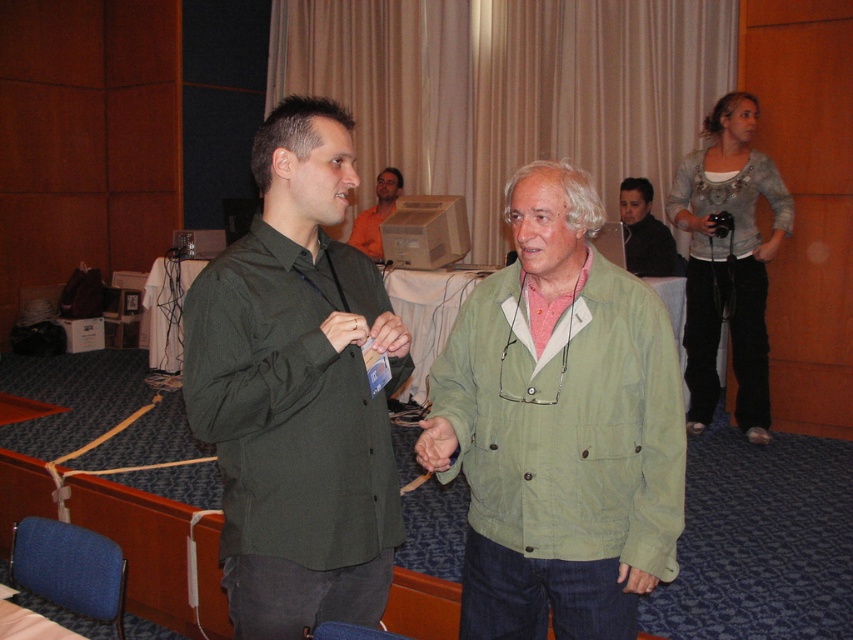
You are organizing a clothing display and need to arrange the green matte shirt at center and the orange shirt at upper center side by side. Which shirt should you place on the left to ensure they fit within a 1.2 meter wide display area?

The green matte shirt at center has a smaller width than the orange shirt at upper center. To fit them within the 1.2 meter display area, place the narrower green matte shirt at center on the left and the wider orange shirt at upper center on the right, ensuring their combined width does not exceed the available space.

What object is located at the coordinates point (297, 390)?

The point (297, 390) corresponds to the green matte shirt at center.

You are standing in the conference room and need to hand a document to the man wearing the green fabric jacket at center. To avoid confusion with the other man in a green matte shirt at center, which clothing item should you look for to identify the correct person?

The green fabric jacket at center is located below the green matte shirt at center. Look for the green fabric jacket that is positioned below the green matte shirt to ensure you are addressing the correct individual.